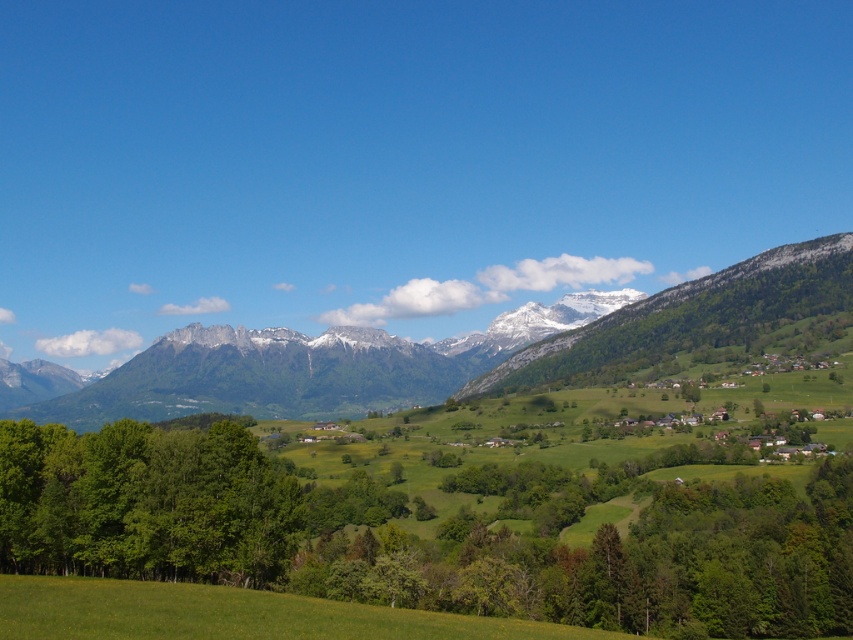
You are standing in the valley and looking towards the mountains. Which object is higher in your field of view, the green grassy mountain range at upper center or the green leafy trees at left?

The green grassy mountain range at upper center is higher in your field of view because it is positioned above the green leafy trees at left.

You are standing at the point marked as point (x=463, y=349) in the image. Based on the scene description, what type of terrain are you currently on?

The point (x=463, y=349) is on green grassy mountain range at upper center, so you are currently on a grassy mountain slope.

You are standing in the valley looking towards the mountains. There are two points marked in the image. The first point is at coordinates point (264, 410) and the second point is at point (94, 566). Which point is closer to you?

Point (94, 566) is closer to you because it is in front of point (264, 410).